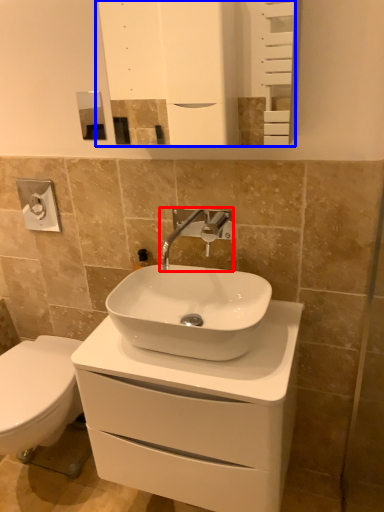
Question: Which point is closer to the camera, tap (highlighted by a red box) or mirror (highlighted by a blue box)?

Choices:
 (A) tap
 (B) mirror

Answer: (B)